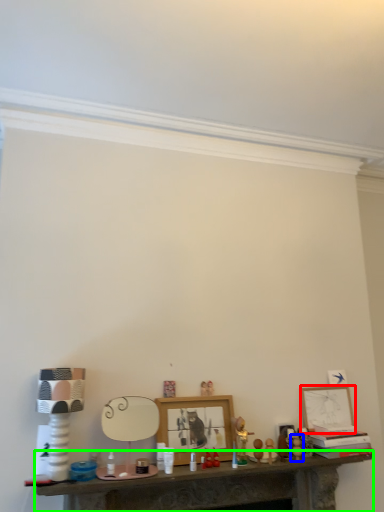
Question: Which object is positioned closest to picture frame (highlighted by a red box)? Select from toy (highlighted by a blue box) and table (highlighted by a green box).

Choices:
 (A) toy
 (B) table

Answer: (A)